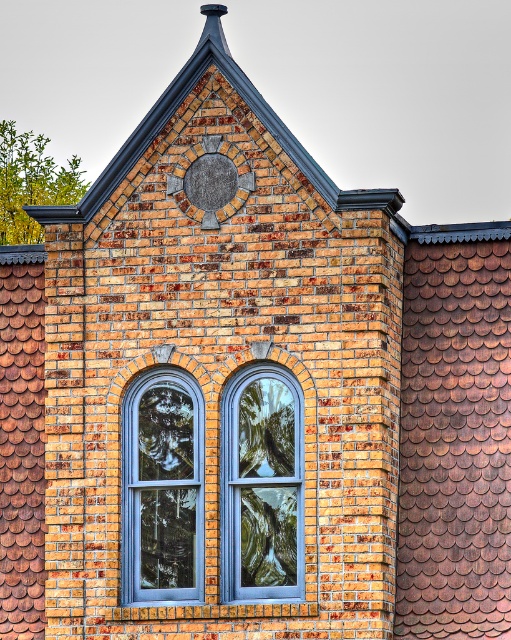
You are standing in front of a historic building with a brick wall and a triangular pediment. You notice two points marked on the wall at coordinates point (x=130, y=24) and point (x=240, y=522). Which point is closer to you?

Point (x=130, y=24) is further to the viewer than point (x=240, y=522), so the point closer to you is point (x=240, y=522).

You are an architect analyzing the building exterior. The blue glass window at center is represented by point (162, 486). Is this point located in the lower half of the triangular pediment?

The blue glass window at center is represented by point (162, 486). Since the triangular pediment is at the top of the brick wall section, the point (162, 486) would be located in the lower half of the triangular pediment.

You are an architect assessing the building facade. You need to install a new rectangular sign that must be smaller than the brown shingles at upper right. Can the matte gray clock at center be used as a reference for the sign size? Explain your reasoning.

The brown shingles at upper right is bigger than matte gray clock at center. Since the sign must be smaller than the brown shingles, the matte gray clock at center can serve as a reference because it is smaller than the required maximum size.